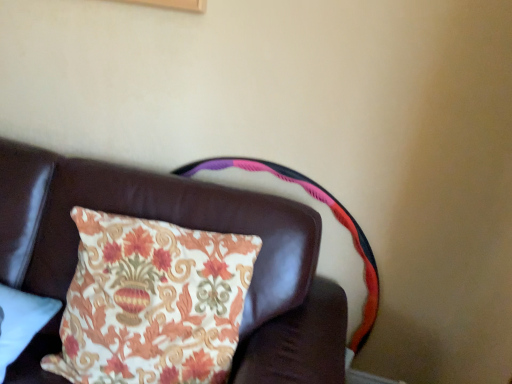
Locate an element on the screen. floral fabric cushion at upper center is located at coordinates (322, 231).

Describe the element at coordinates (21, 322) in the screenshot. The width and height of the screenshot is (512, 384). I see `floral fabric pillow at lower left` at that location.

Locate an element on the screen. The width and height of the screenshot is (512, 384). leather couch cushion at upper left is located at coordinates (188, 227).

You are a GUI agent. You are given a task and a screenshot of the screen. Output one action in this format:
    pyautogui.click(x=<x>, y=<y>)
    Task: Click on the floral fabric cushion at upper center
    
    Given the screenshot: What is the action you would take?
    pyautogui.click(x=322, y=231)

Is floral fabric cushion at upper center in front of or behind leather couch cushion at upper left in the image?

In the image, floral fabric cushion at upper center appears behind leather couch cushion at upper left.

Considering the relative sizes of floral fabric cushion at upper center and leather couch cushion at upper left in the image provided, is floral fabric cushion at upper center smaller than leather couch cushion at upper left?

Yes, floral fabric cushion at upper center is smaller than leather couch cushion at upper left.

From a real-world perspective, is floral fabric cushion at upper center located higher than leather couch cushion at upper left?

Correct, in the physical world, floral fabric cushion at upper center is higher than leather couch cushion at upper left.

Which is farther, [353,265] or [32,360]?

The point [353,265] is farther.

Between floral fabric pillow at lower left and leather couch cushion at upper left, which one is positioned behind?

floral fabric pillow at lower left is behind.

Is floral fabric pillow at lower left far from leather couch cushion at upper left?

No.

Is floral fabric pillow at lower left turned away from leather couch cushion at upper left?

Yes, floral fabric pillow at lower left's orientation is away from leather couch cushion at upper left.

Does floral fabric pillow at lower left have a greater width compared to leather couch cushion at upper left?

In fact, floral fabric pillow at lower left might be narrower than leather couch cushion at upper left.

Is leather couch cushion at upper left oriented towards floral fabric cushion at upper center?

No, leather couch cushion at upper left is not facing towards floral fabric cushion at upper center.

Between leather couch cushion at upper left and floral fabric cushion at upper center, which one has smaller width?

floral fabric cushion at upper center is thinner.

Does point (53, 207) appear closer or farther from the camera than point (369, 328)?

Point (53, 207) is positioned closer to the camera compared to point (369, 328).

Does leather couch cushion at upper left have a larger size compared to floral fabric cushion at upper center?

Yes.

Is leather couch cushion at upper left not near floral fabric pillow at lower left?

leather couch cushion at upper left is near floral fabric pillow at lower left, not far away.

Which is in front, leather couch cushion at upper left or floral fabric pillow at lower left?

leather couch cushion at upper left.

Does leather couch cushion at upper left contain floral fabric pillow at lower left?

Yes.

Is floral fabric pillow at lower left aimed at floral fabric cushion at upper center?

No.

Can you see floral fabric pillow at lower left touching floral fabric cushion at upper center?

No, floral fabric pillow at lower left is not with floral fabric cushion at upper center.

From the image's perspective, between floral fabric pillow at lower left and floral fabric cushion at upper center, who is located below?

From the image's view, floral fabric pillow at lower left is below.

Considering the sizes of objects floral fabric pillow at lower left and floral fabric cushion at upper center in the image provided, who is thinner, floral fabric pillow at lower left or floral fabric cushion at upper center?

floral fabric cushion at upper center is thinner.

Are floral fabric cushion at upper center and floral fabric pillow at lower left far apart?

No, floral fabric cushion at upper center is not far from floral fabric pillow at lower left.

Find the location of a particular element. Image resolution: width=512 pixels, height=384 pixels. pillow below the floral fabric cushion at upper center (from a real-world perspective) is located at coordinates (21, 322).

Is floral fabric cushion at upper center positioned with its back to floral fabric pillow at lower left?

No, floral fabric cushion at upper center is not facing the opposite direction of floral fabric pillow at lower left.

In order to click on furniture in front of the floral fabric cushion at upper center in this screenshot , I will do `click(188, 227)`.

Identify the location of pillow on the left side of leather couch cushion at upper left. This screenshot has height=384, width=512. (21, 322).

Which object lies further to the anchor point leather couch cushion at upper left, floral fabric pillow at lower left or floral fabric cushion at upper center?

floral fabric pillow at lower left lies further to leather couch cushion at upper left than the other object.

Which object lies nearer to the anchor point floral fabric cushion at upper center, leather couch cushion at upper left or floral fabric pillow at lower left?

leather couch cushion at upper left is closer to floral fabric cushion at upper center.

Considering their positions, is floral fabric cushion at upper center positioned closer to leather couch cushion at upper left than floral fabric pillow at lower left?

Based on the image, floral fabric cushion at upper center appears to be nearer to leather couch cushion at upper left.

Which object lies further to the anchor point floral fabric pillow at lower left, floral fabric cushion at upper center or leather couch cushion at upper left?

floral fabric cushion at upper center is further to floral fabric pillow at lower left.

From the image, which object appears to be farther from floral fabric cushion at upper center, floral fabric pillow at lower left or leather couch cushion at upper left?

Among the two, floral fabric pillow at lower left is located further to floral fabric cushion at upper center.

Which object lies nearer to the anchor point floral fabric pillow at lower left, leather couch cushion at upper left or floral fabric cushion at upper center?

Based on the image, leather couch cushion at upper left appears to be nearer to floral fabric pillow at lower left.

Locate an element on the screen. Image resolution: width=512 pixels, height=384 pixels. pillow between leather couch cushion at upper left and floral fabric cushion at upper center along the z-axis is located at coordinates (21, 322).